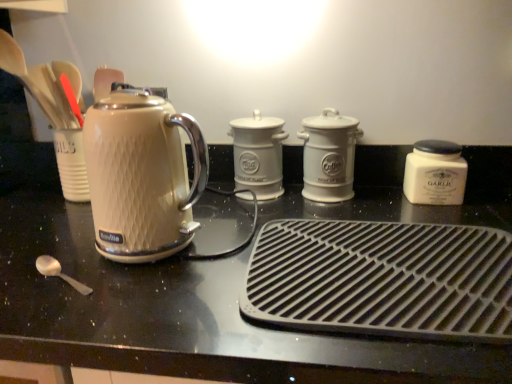
Locate an element on the screen. The image size is (512, 384). vacant space in between white ceramic coffee canister at center, acting as the 2th kitchen appliance starting from the back, and black rubber mat at center, which is the first kitchen appliance from front to back is located at coordinates (367, 210).